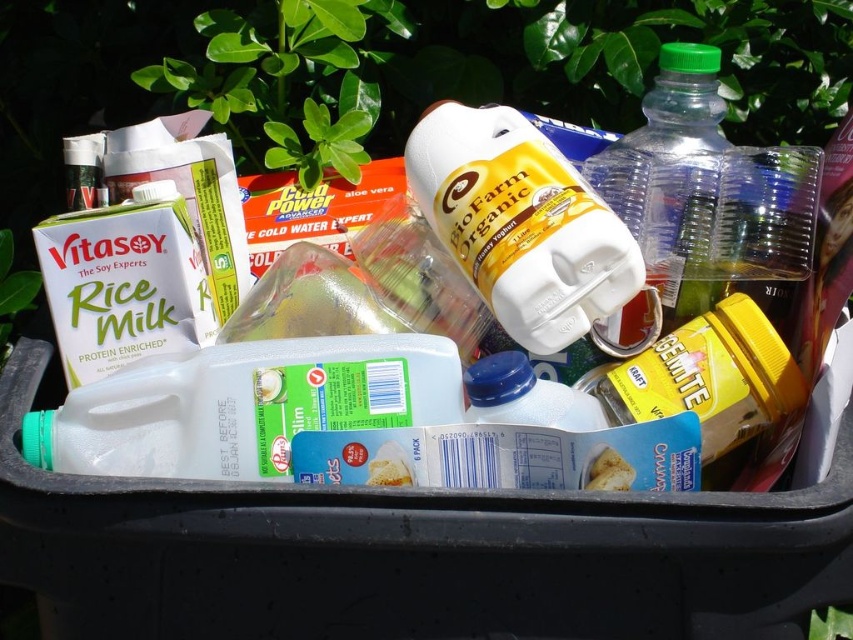
Between point (439, 134) and point (596, 488), which one is positioned behind?

The point (439, 134) is behind.

Is white plastic jug at center wider than white matte bread at center?

Yes.

Between point (547, 141) and point (596, 454), which one is positioned behind?

The point (547, 141) is more distant.

Locate an element on the screen. Image resolution: width=853 pixels, height=640 pixels. white plastic jug at center is located at coordinates (520, 224).

Does point (434, 168) lie behind point (683, 332)?

That is True.

Does white plastic jug at center have a greater height compared to yellow matte jar at center-right?

Correct, white plastic jug at center is much taller as yellow matte jar at center-right.

Image resolution: width=853 pixels, height=640 pixels. Describe the element at coordinates (520, 224) in the screenshot. I see `white plastic jug at center` at that location.

Locate an element on the screen. This screenshot has height=640, width=853. white plastic jug at center is located at coordinates (520, 224).

Is green translucent bottle at center-right positioned at the back of yellow matte jar at center-right?

Yes, it is behind yellow matte jar at center-right.

Which is below, green translucent bottle at center-right or yellow matte jar at center-right?

yellow matte jar at center-right is below.

The height and width of the screenshot is (640, 853). What do you see at coordinates (662, 184) in the screenshot? I see `green translucent bottle at center-right` at bounding box center [662, 184].

This screenshot has height=640, width=853. I want to click on green translucent bottle at center-right, so click(x=662, y=184).